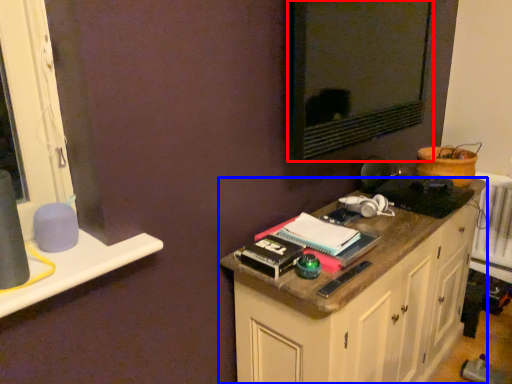
Question: Among these objects, which one is nearest to the camera, wide (highlighted by a red box) or cabinetry (highlighted by a blue box)?

Choices:
 (A) wide
 (B) cabinetry

Answer: (B)